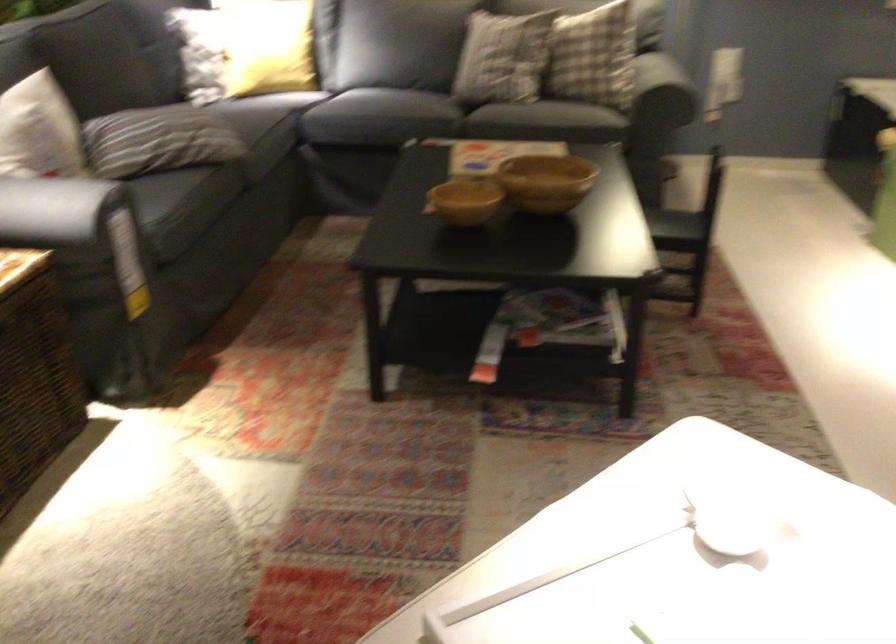
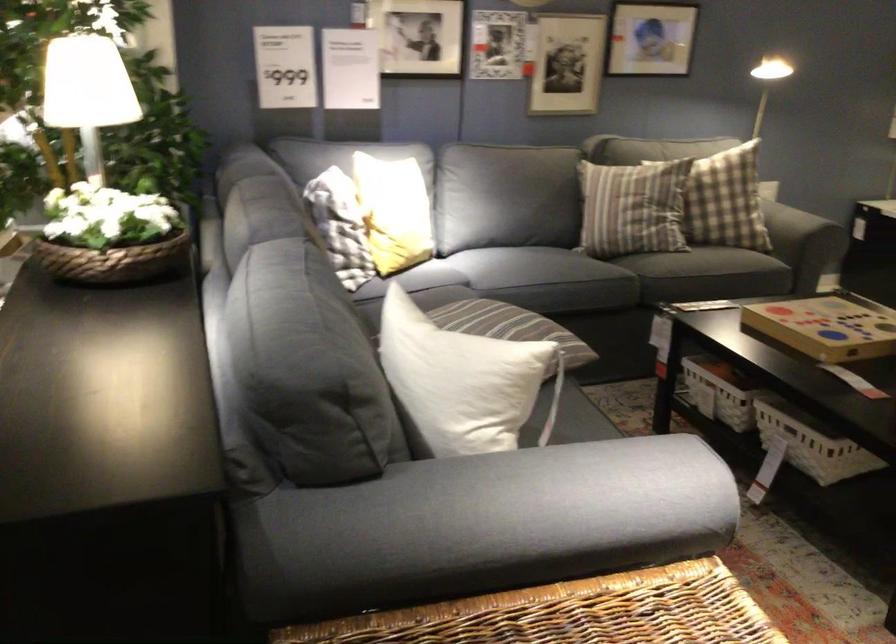
Locate, in the second image, the point that corresponds to (x=455, y=158) in the first image.

(828, 326)